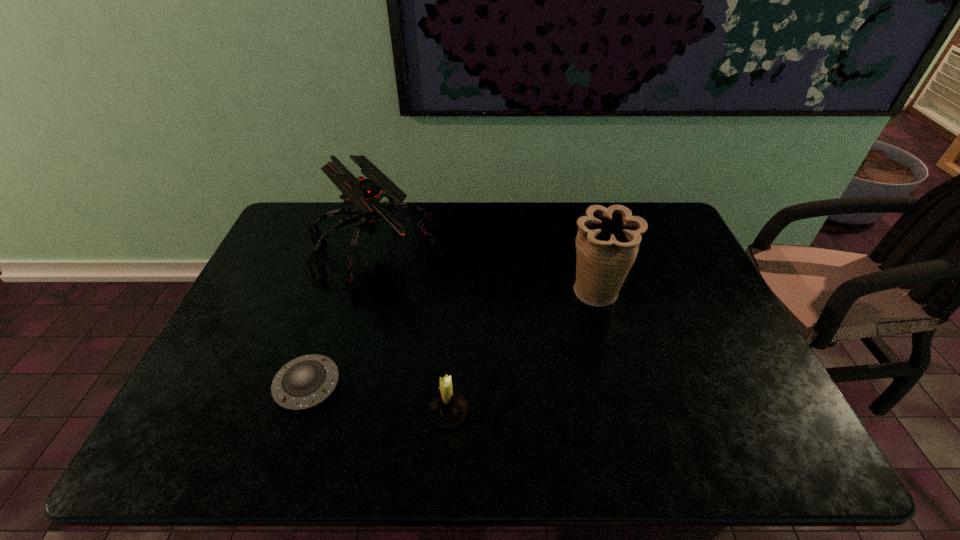
You are a GUI agent. You are given a task and a screenshot of the screen. Output one action in this format:
    pyautogui.click(x=<x>, y=<y>)
    Task: Click on the vacant space that satisfies the following two spatial constraints: 1. on the front side of the drone; 2. on the left side of the urn
    
    Given the screenshot: What is the action you would take?
    pyautogui.click(x=363, y=293)

Locate an element on the screen. vacant region that satisfies the following two spatial constraints: 1. on the front side of the drone; 2. on the left side of the urn is located at coordinates (363, 293).

Locate an element on the screen. vacant position in the image that satisfies the following two spatial constraints: 1. on the front side of the drone; 2. on the left side of the candle holder is located at coordinates (331, 412).

The width and height of the screenshot is (960, 540). I want to click on free point that satisfies the following two spatial constraints: 1. on the back side of the urn; 2. on the right side of the candle holder, so [x=455, y=293].